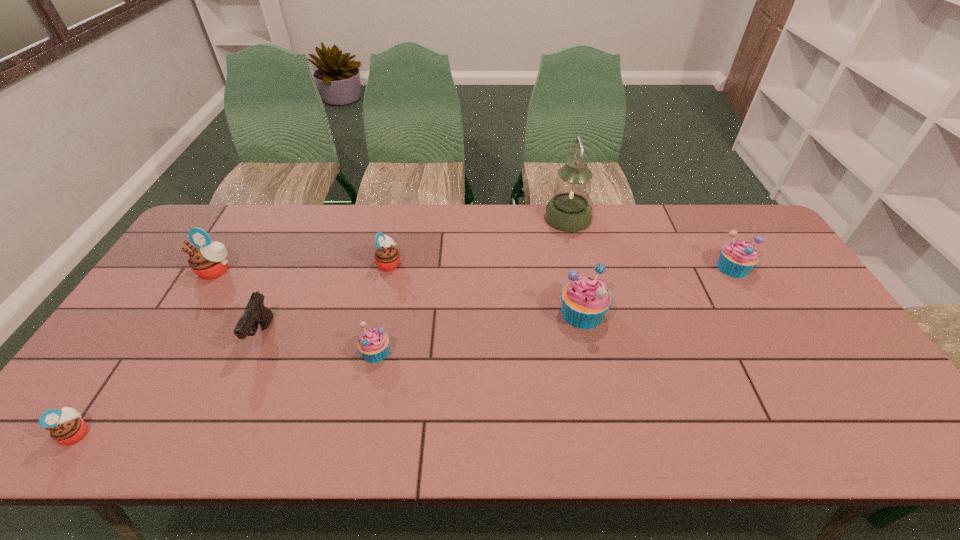
Image resolution: width=960 pixels, height=540 pixels. Identify the location of vacant position in the image that satisfies the following two spatial constraints: 1. on the back side of the tallest object; 2. on the right side of the smallest blue muffin. (403, 218).

Where is `free space in the image that satisfies the following two spatial constraints: 1. on the front-facing side of the rightmost pink muffin; 2. on the front-facing side of the biggest pink muffin`? The image size is (960, 540). free space in the image that satisfies the following two spatial constraints: 1. on the front-facing side of the rightmost pink muffin; 2. on the front-facing side of the biggest pink muffin is located at coordinates (388, 271).

What are the coordinates of `free space that satisfies the following two spatial constraints: 1. on the front-facing side of the second farthest blue muffin; 2. on the right side of the rightmost pink muffin` in the screenshot? It's located at (378, 313).

The width and height of the screenshot is (960, 540). Find the location of `free location that satisfies the following two spatial constraints: 1. on the front-facing side of the seventh object from right to left; 2. on the left side of the leftmost blue muffin`. free location that satisfies the following two spatial constraints: 1. on the front-facing side of the seventh object from right to left; 2. on the left side of the leftmost blue muffin is located at coordinates (167, 352).

This screenshot has height=540, width=960. I want to click on vacant space that satisfies the following two spatial constraints: 1. on the back side of the farthest blue muffin; 2. on the right side of the third nearest muffin, so click(x=572, y=267).

Locate an element on the screen. The image size is (960, 540). vacant position in the image that satisfies the following two spatial constraints: 1. at the barrel of the black pistol; 2. on the front-facing side of the leftmost pink muffin is located at coordinates (219, 433).